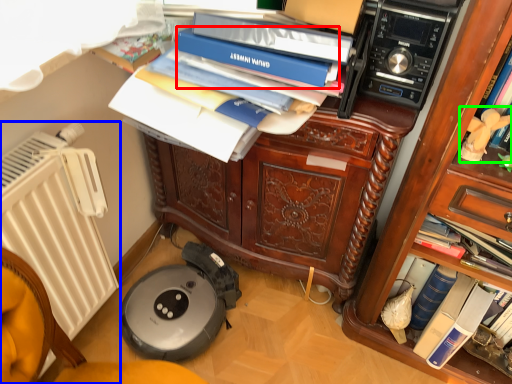
Question: Which object is positioned closest to paperback book (highlighted by a red box)? Select from radiator (highlighted by a blue box) and person (highlighted by a green box).

Choices:
 (A) radiator
 (B) person

Answer: (B)